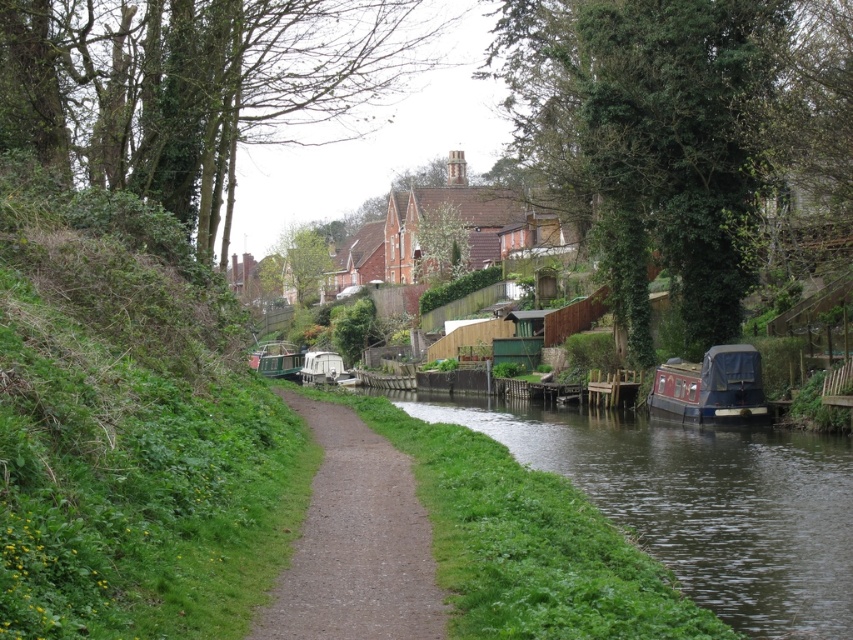
Question: Which object appears farthest from the camera in this image?

Choices:
 (A) green leafy tree at upper center
 (B) brown gravel path at center

Answer: (A)

Question: Which object is closer to the camera taking this photo?

Choices:
 (A) green leafy tree at upper center
 (B) red painted wooden boat at right
 (C) dark blue wood at lower right
 (D) green grassy hillside at left

Answer: (D)

Question: Is green leafy tree at upper left behind brown gravel path at center?

Choices:
 (A) no
 (B) yes

Answer: (B)

Question: From the image, what is the correct spatial relationship of green leafy tree at center in relation to green matte boat at center?

Choices:
 (A) right
 (B) left

Answer: (A)

Question: Does green leafy tree at upper center appear under green leafy tree at upper left?

Choices:
 (A) yes
 (B) no

Answer: (A)

Question: Estimate the real-world distances between objects in this image. Which object is farther from the white plastic boat at center?

Choices:
 (A) brown gravel path at center
 (B) green leafy tree at center
 (C) green leafy tree at upper center

Answer: (A)